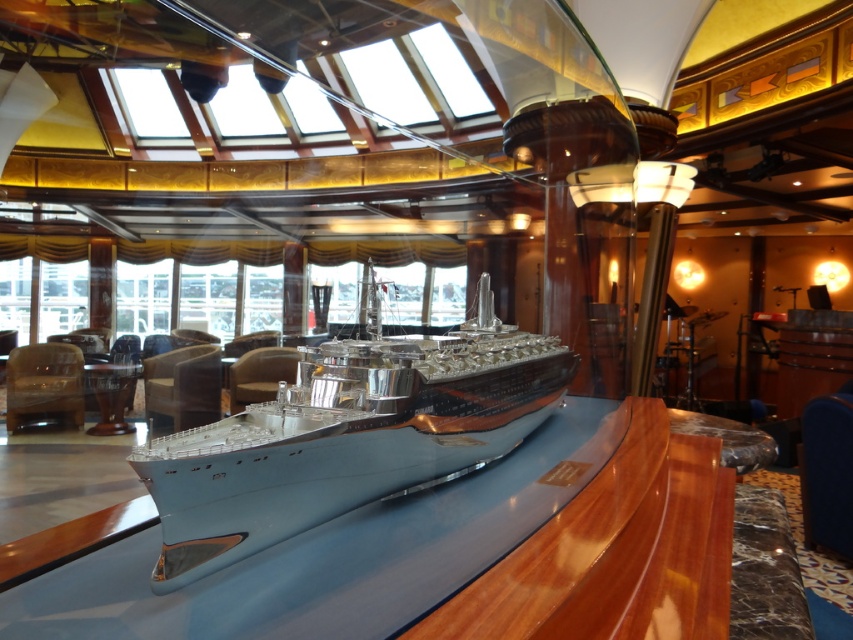
You are standing in the cruise ship venue and want to walk from the point at coordinates point (805, 420) to the point at coordinates point (25, 387). Which direction should you move to reach your destination?

To move from point (805, 420) to point (25, 387), you should move downward since point (805, 420) is in front of point (25, 387), indicating it is closer to the viewer and thus higher in the image.

You are designing a layout for a cruise ship exhibit and need to place both the light blue metallic ship at center and the matte brown leather armchair at center. Since the ship is smaller in width than the armchair, which object should be placed closer to the entrance to ensure visitors can easily view both without obstruction?

The light blue metallic ship at center should be placed closer to the entrance since it is narrower than the matte brown leather armchair at center, allowing visitors to view both objects comfortably without obstruction.